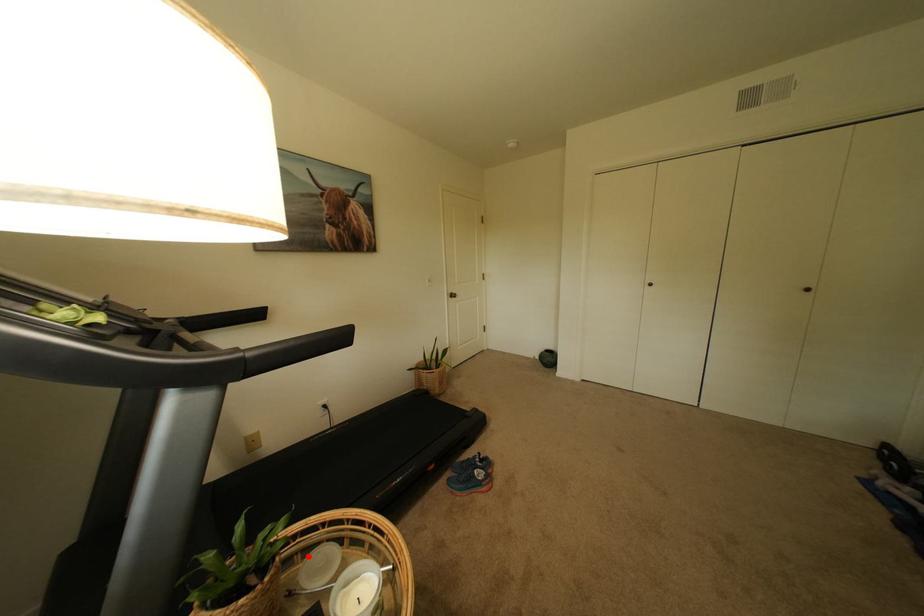
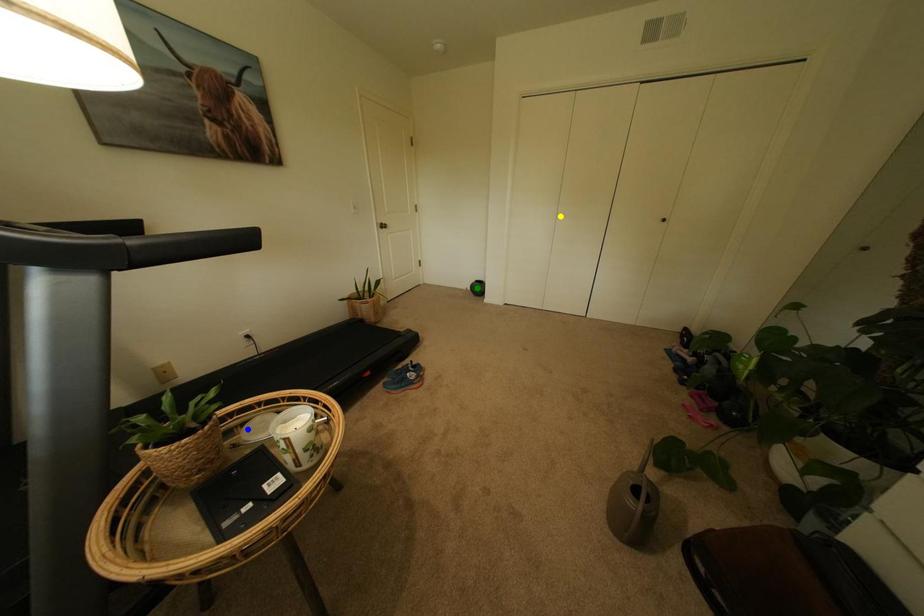
Question: I am providing you with two images of the same scene from different viewpoints. A red point is marked on the first image. You are given multiple points on the second image. Which point in image 2 represents the same 3d spot as the red point in image 1?

Choices:
 (A) blue point
 (B) green point
 (C) yellow point

Answer: (A)